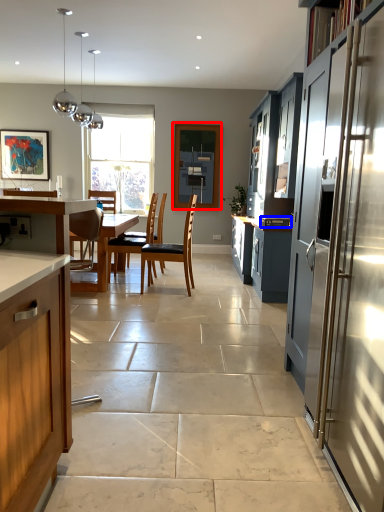
Question: Which object appears farthest to the camera in this image, window screen (highlighted by a red box) or appliance (highlighted by a blue box)?

Choices:
 (A) window screen
 (B) appliance

Answer: (A)